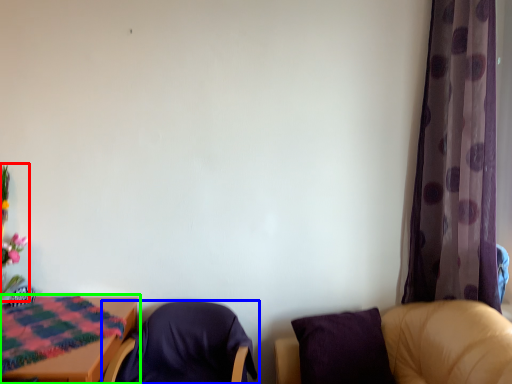
Question: Estimate the real-world distances between objects in this image. Which object is farther from floral arrangement (highlighted by a red box), chair (highlighted by a blue box) or table (highlighted by a green box)?

Choices:
 (A) chair
 (B) table

Answer: (A)